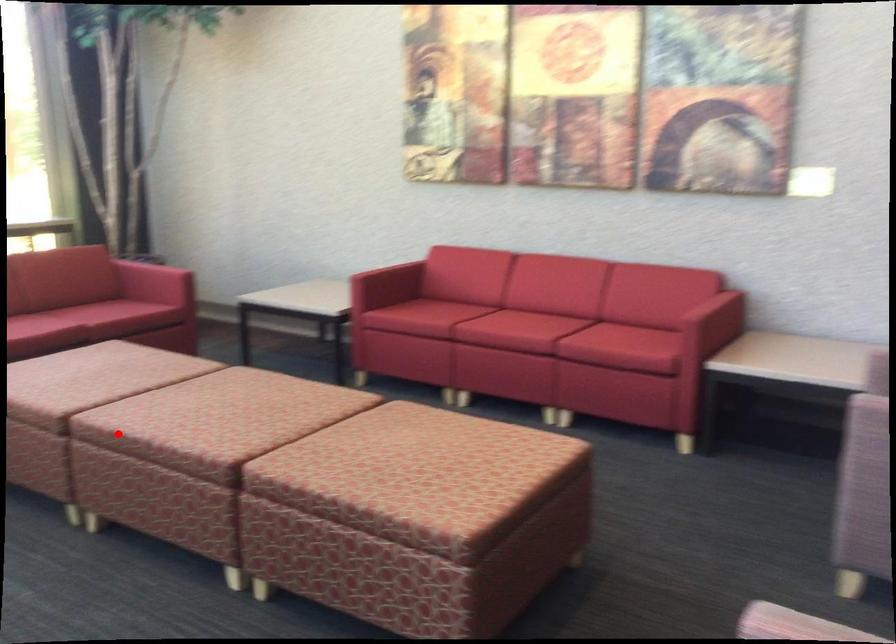
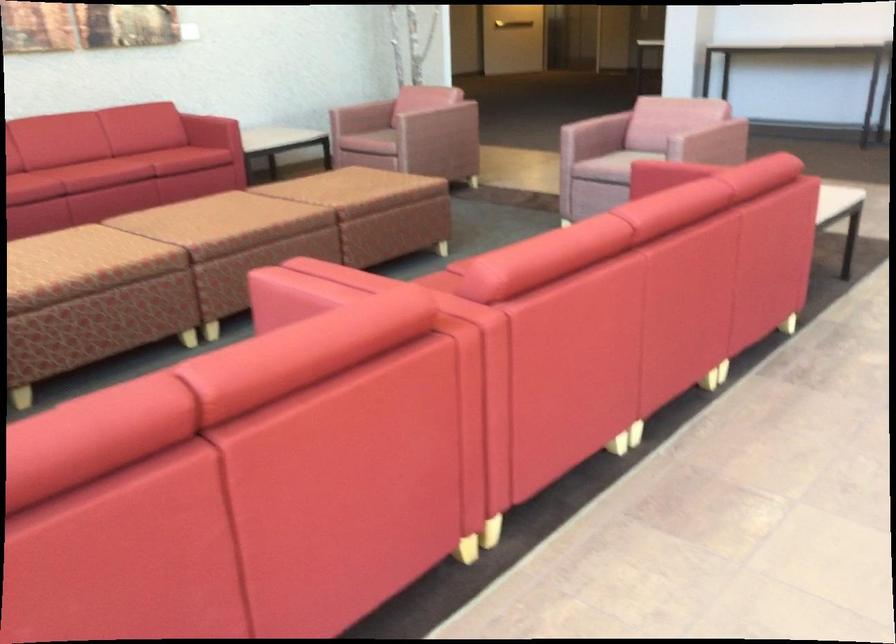
Question: I am providing you with two images of the same scene from different viewpoints. Image1 has a red point marked. In image2, the corresponding 3D location appears at what relative position? Reply with the corresponding letter.

Choices:
 (A) Closer
 (B) Farther

Answer: (B)